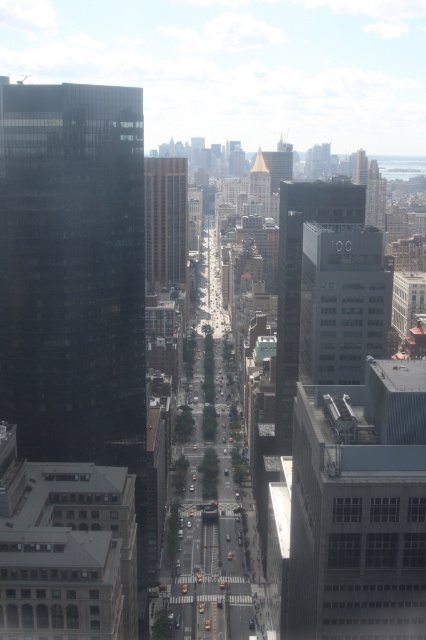
From the picture: You are a city planner assessing the distance between the dark glass skyscraper at center and the gold metallic tower at center for a new pedestrian bridge project. The minimum required distance for the bridge is 50 meters. Based on the scene, will the bridge be feasible?

The dark glass skyscraper at center is 49.62 meters from the gold metallic tower at center, which is just below the 50 meters requirement. Therefore, the pedestrian bridge project may not be feasible as the distance is insufficient.